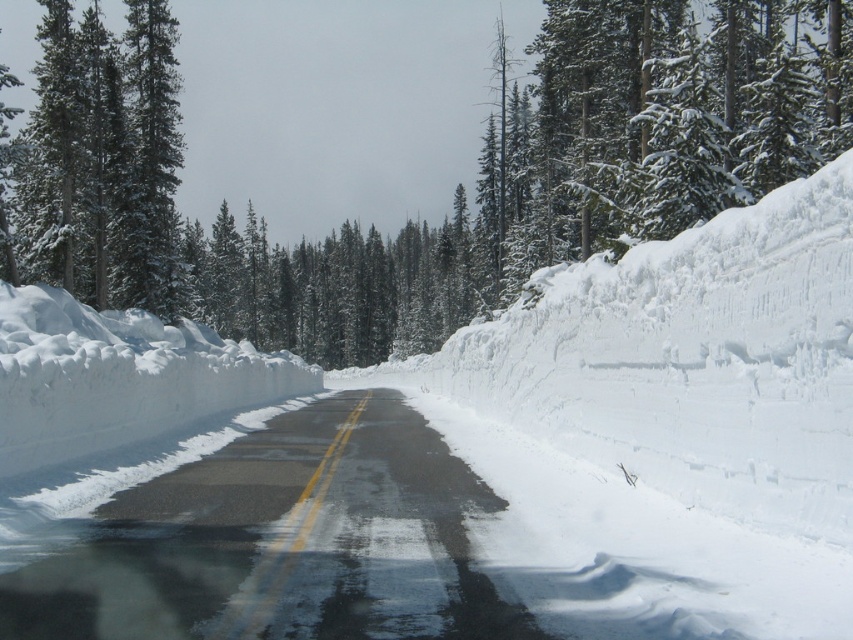
Is glossy asphalt road at center thinner than green textured pine trees at left?

Yes, glossy asphalt road at center is thinner than green textured pine trees at left.

Who is lower down, glossy asphalt road at center or green textured pine trees at left?

Positioned lower is glossy asphalt road at center.

Is point (390, 637) more distant than point (67, 104)?

No, (390, 637) is in front of (67, 104).

Where is `glossy asphalt road at center`? The width and height of the screenshot is (853, 640). glossy asphalt road at center is located at coordinates (283, 541).